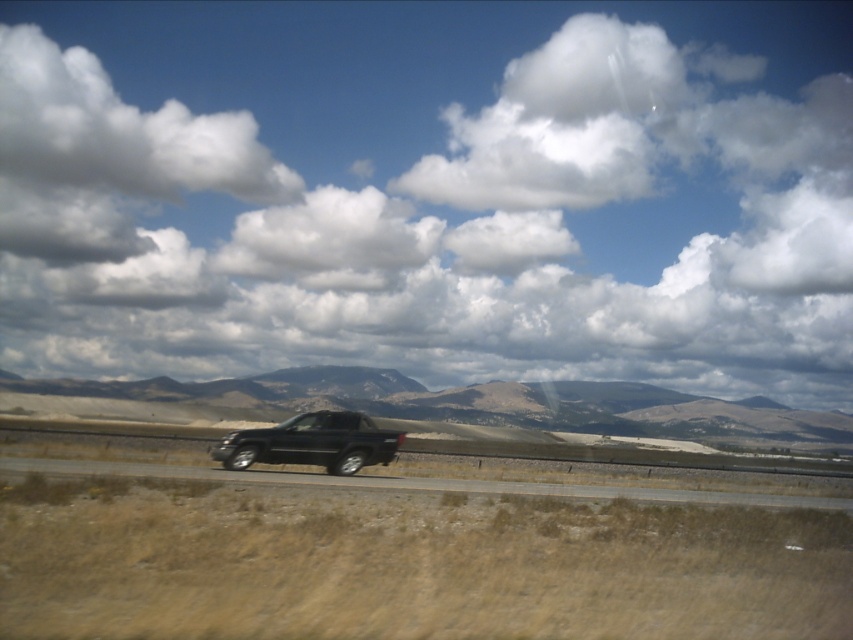
Does white fluffy cloud at upper center have a greater width compared to glossy black truck at center?

Yes.

Between point (503, 336) and point (303, 452), which one is positioned behind?

Point (503, 336)

Image resolution: width=853 pixels, height=640 pixels. I want to click on white fluffy cloud at upper center, so click(x=430, y=192).

Between glossy black truck at center and transparent glass window at center, which one has less height?

transparent glass window at center

Does point (326, 442) lie in front of point (300, 428)?

Yes, it is.

Where is `glossy black truck at center`? This screenshot has width=853, height=640. glossy black truck at center is located at coordinates (312, 442).

Can you confirm if white fluffy cloud at upper center is positioned to the left of black asphalt highway at center?

Yes, white fluffy cloud at upper center is to the left of black asphalt highway at center.

Who is shorter, white fluffy cloud at upper center or black asphalt highway at center?

With less height is black asphalt highway at center.

Between point (283, 20) and point (585, 484), which one is positioned behind?

The point (283, 20) is behind.

The width and height of the screenshot is (853, 640). What are the coordinates of `white fluffy cloud at upper center` in the screenshot? It's located at (430, 192).